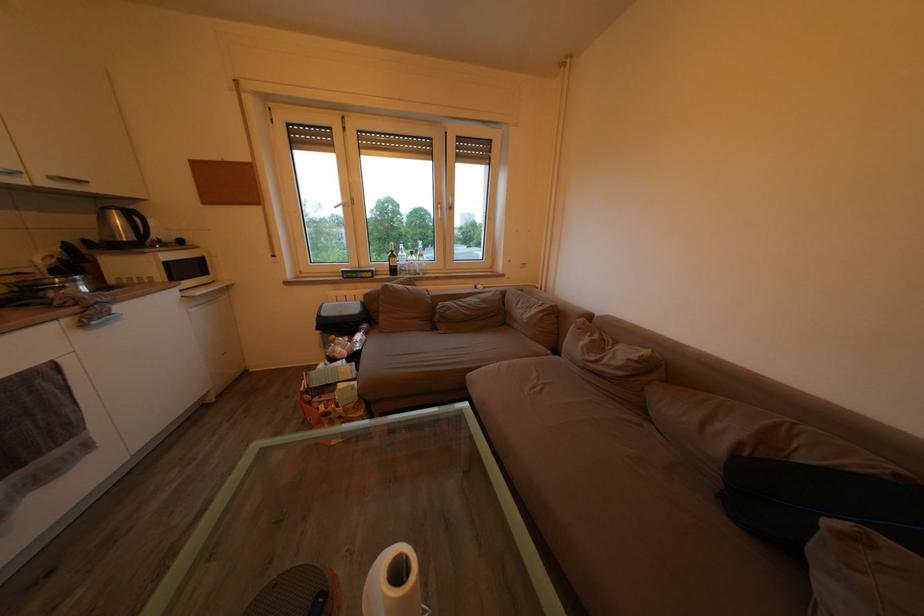
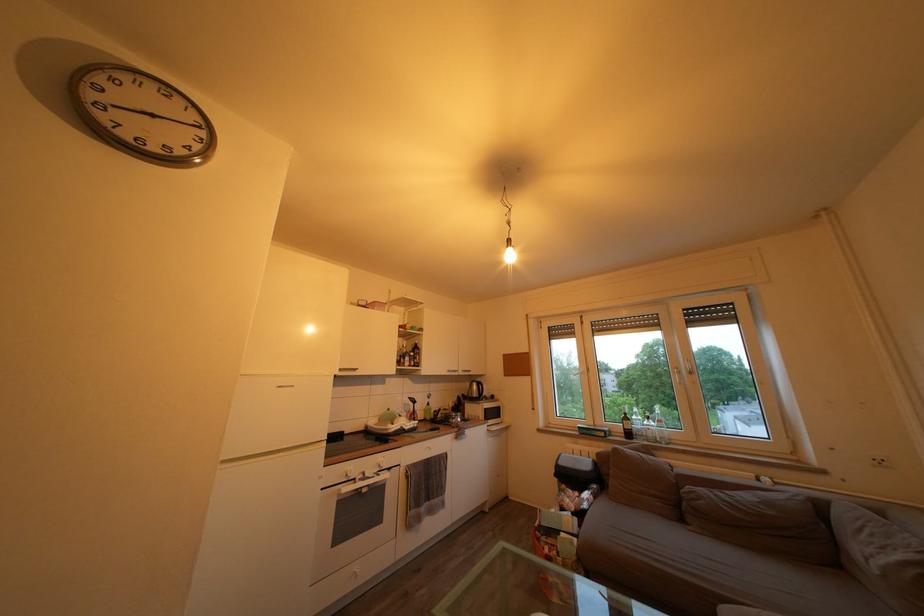
Where in the second image is the point corresponding to (x=397, y=262) from the first image?

(630, 426)